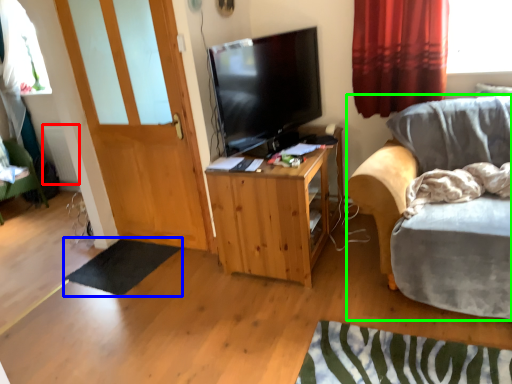
Question: Estimate the real-world distances between objects in this image. Which object is closer to radiator (highlighted by a red box), flat (highlighted by a blue box) or chair (highlighted by a green box)?

Choices:
 (A) flat
 (B) chair

Answer: (A)